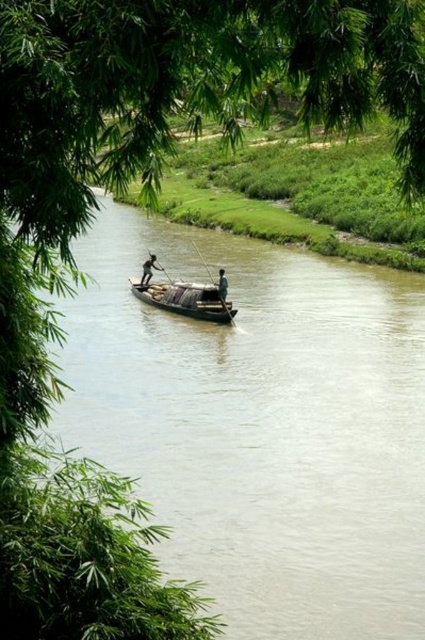
You are a photographer trying to capture the dark brown wooden boat at center and the wooden paddle at center in the same frame. Based on their heights, which object will appear larger in the photo?

The wooden paddle at center is taller than the dark brown wooden boat at center, so it will appear larger in the photo.

You are standing on the riverbank and see the dark brown wooden boat at center and the light brown wooden pole at center. Which object is closer to you?

The dark brown wooden boat at center is closer to you because the light brown wooden pole at center is behind it.

You are standing on the riverbank and see the dark brown wooden boat at center and the light brown wooden pole at center. Which object is closer to the water surface?

The light brown wooden pole at center is closer to the water surface because the dark brown wooden boat at center is located above it.